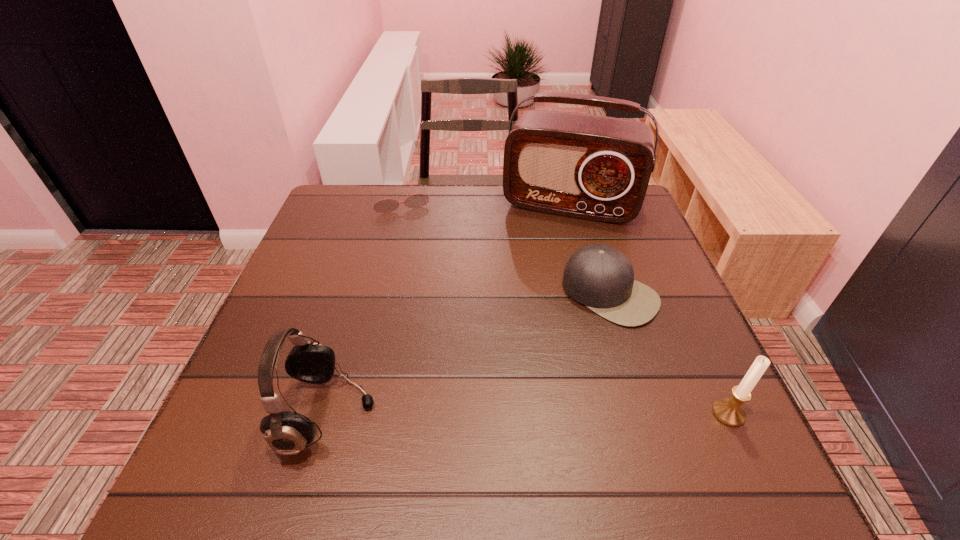
At what (x,y) coordinates should I click in order to perform the action: click on vacant space at the far edge of the desktop. Please return your answer as a coordinate pair (x, y). This screenshot has height=540, width=960. Looking at the image, I should click on (530, 225).

In the image, there is a desktop. Where is `vacant area at the near edge`? This screenshot has height=540, width=960. vacant area at the near edge is located at coordinates (479, 424).

Where is `vacant space at the left edge of the desktop`? The image size is (960, 540). vacant space at the left edge of the desktop is located at coordinates (360, 260).

Locate an element on the screen. This screenshot has height=540, width=960. vacant space at the right edge of the desktop is located at coordinates 705,354.

This screenshot has width=960, height=540. Identify the location of vacant space at the near left corner of the desktop. (243, 414).

Identify the location of unoccupied position between the sunglasses and the third shortest object. The image size is (960, 540). pos(564,307).

This screenshot has width=960, height=540. Find the location of `vacant area between the tallest object and the second tallest object`. vacant area between the tallest object and the second tallest object is located at coordinates (449, 309).

Where is `empty space that is in between the tallest object and the sunglasses`? This screenshot has width=960, height=540. empty space that is in between the tallest object and the sunglasses is located at coordinates (485, 203).

Where is `empty space that is in between the second tallest object and the cap`? The image size is (960, 540). empty space that is in between the second tallest object and the cap is located at coordinates (469, 354).

Where is `vacant area that lies between the second shortest object and the headset`? The width and height of the screenshot is (960, 540). vacant area that lies between the second shortest object and the headset is located at coordinates (469, 354).